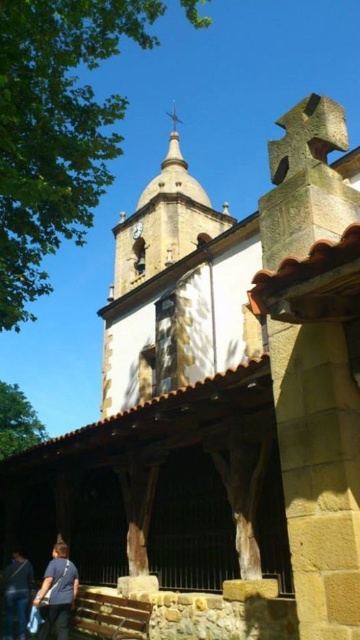
You are standing at the base of the bell tower in the church scene. You notice a blue cotton shirt at lower left and a white glossy clock at upper center. If you want to reach the clock from the shirt, which direction should you move relative to the shirt?

To reach the white glossy clock at upper center from the blue cotton shirt at lower left, you would need to move upward and to the right, as the clock is positioned higher and to the right of the shirt.

You are standing in front of the church and see the blue cotton shirt at lower left and the white glossy clock at upper center. Which object is located to the right of the other?

The blue cotton shirt at lower left is positioned on the right side of white glossy clock at upper center.

You are standing in front of the church and notice a person wearing a blue cotton shirt at lower left and blue denim jeans at lower left. Which clothing item is wider?

The blue cotton shirt at lower left is wider than the blue denim jeans at lower left according to the description.